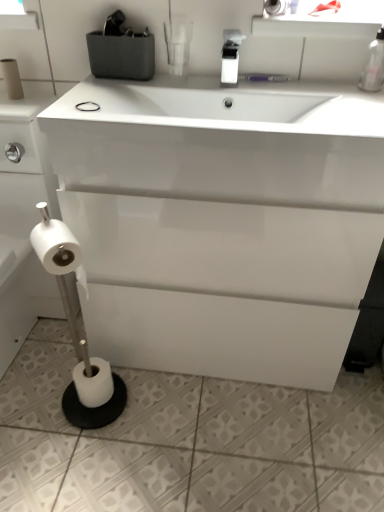
Question: From a real-world perspective, is white glossy soap dispenser at upper center, which is counted as the 1th bottle, starting from the left, physically below white matte toilet paper at lower left, placed as the 2th toilet paper when sorted from bottom to top?

Choices:
 (A) no
 (B) yes

Answer: (A)

Question: Considering the relative sizes of white glossy soap dispenser at upper center, the 2th bottle in the right-to-left sequence, and white matte toilet paper at lower left, the 3th toilet paper viewed from the right, in the image provided, is white glossy soap dispenser at upper center, the 2th bottle in the right-to-left sequence, taller than white matte toilet paper at lower left, the 3th toilet paper viewed from the right,?

Choices:
 (A) yes
 (B) no

Answer: (B)

Question: Is white glossy soap dispenser at upper center, the 2th bottle in the right-to-left sequence, bigger than white matte toilet paper at lower left, placed as the 2th toilet paper when sorted from bottom to top?

Choices:
 (A) yes
 (B) no

Answer: (B)

Question: Is white glossy soap dispenser at upper center, which is counted as the 1th bottle, starting from the left, thinner than white matte toilet paper at lower left, placed as the 2th toilet paper when sorted from bottom to top?

Choices:
 (A) yes
 (B) no

Answer: (B)

Question: Does white glossy soap dispenser at upper center, which is counted as the 1th bottle, starting from the left, have a greater width compared to white matte toilet paper at lower left, the 3th toilet paper viewed from the right?

Choices:
 (A) yes
 (B) no

Answer: (A)

Question: Does white glossy soap dispenser at upper center, the 2th bottle in the right-to-left sequence, contain white matte toilet paper at lower left, placed as the 2th toilet paper when sorted from bottom to top?

Choices:
 (A) no
 (B) yes

Answer: (A)

Question: From the image's perspective, is transparent plastic window screen at upper left on white matte toilet paper at left, which is counted as the 2th toilet paper, starting from the top?

Choices:
 (A) no
 (B) yes

Answer: (B)

Question: Could you tell me if transparent plastic window screen at upper left is turned towards white matte toilet paper at left, which is counted as the 2th toilet paper, starting from the top?

Choices:
 (A) no
 (B) yes

Answer: (A)

Question: Is transparent plastic window screen at upper left positioned with its back to white matte toilet paper at left, which is counted as the 2th toilet paper, starting from the top?

Choices:
 (A) no
 (B) yes

Answer: (A)

Question: Is transparent plastic window screen at upper left positioned in front of white matte toilet paper at left, which is counted as the 4th toilet paper, starting from the right?

Choices:
 (A) no
 (B) yes

Answer: (B)

Question: From the image's perspective, is transparent plastic window screen at upper left below white matte toilet paper at left, which is counted as the 4th toilet paper, starting from the right?

Choices:
 (A) yes
 (B) no

Answer: (B)

Question: Is transparent plastic window screen at upper left further to the viewer compared to white matte toilet paper at left, which is counted as the 1th toilet paper, starting from the left?

Choices:
 (A) yes
 (B) no

Answer: (B)

Question: From the image's perspective, is black rubber band at upper center located beneath white matte toilet paper at left, which is counted as the 2th toilet paper, starting from the top?

Choices:
 (A) no
 (B) yes

Answer: (B)